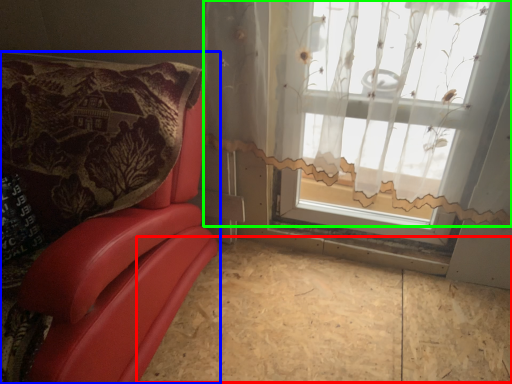
Question: Which object is the closest to the plywood (highlighted by a red box)? Choose among these: furniture (highlighted by a blue box) or curtain (highlighted by a green box).

Choices:
 (A) furniture
 (B) curtain

Answer: (A)